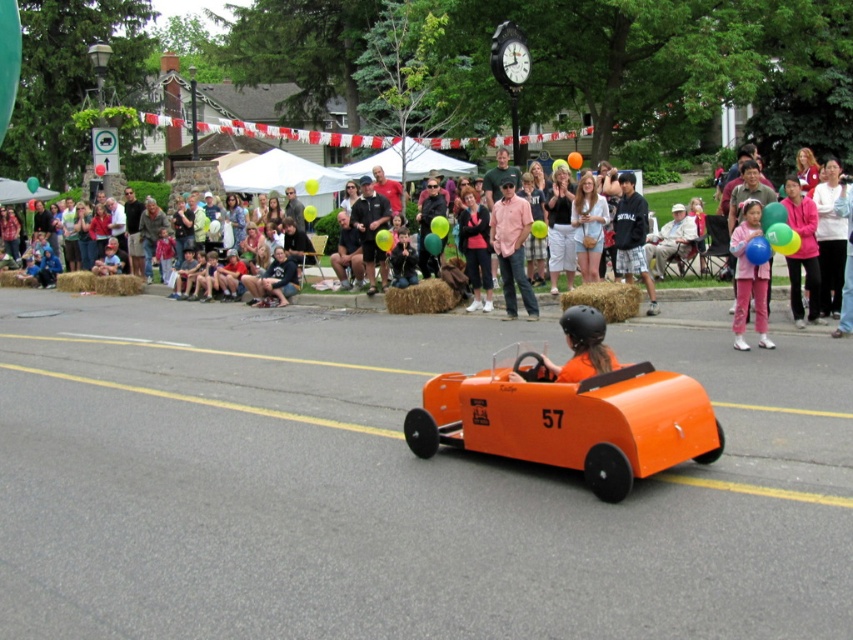
You are a photographer at the event and want to capture a photo of both the dark gray sweatshirt at center and the matte pink shirt at center. Which one should you focus on first if you want to ensure both are in the frame?

You should focus on the dark gray sweatshirt at center first since it is above the matte pink shirt at center, so adjusting the camera to include the higher one first will help capture both in the frame.

You are a photographer at the event and want to capture a photo of both the orange matte race car at center and the matte pink pants at right in the same frame. Which object should you focus on first to ensure both are in the frame?

The orange matte race car at center is shorter than the matte pink pants at right, so focus on the orange matte race car at center first to ensure both are visible in the frame.

You are a photographer at the event and want to capture a photo of the orange matte race car at center and the matte pink pants at right in the same frame. Which object should you focus on first to ensure both are in the frame?

Since the orange matte race car at center is larger than the matte pink pants at right, you should focus on the orange matte race car at center first to ensure both fit within the frame.